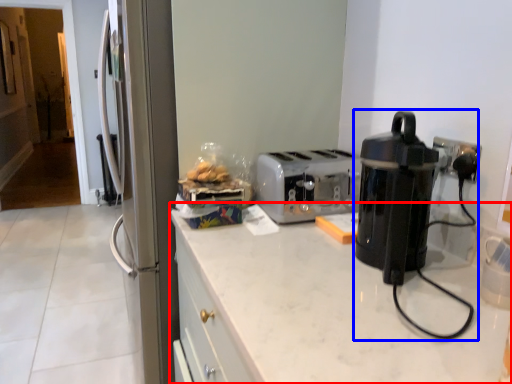
Question: Which object appears farthest to the camera in this image, countertop (highlighted by a red box) or home appliance (highlighted by a blue box)?

Choices:
 (A) countertop
 (B) home appliance

Answer: (B)